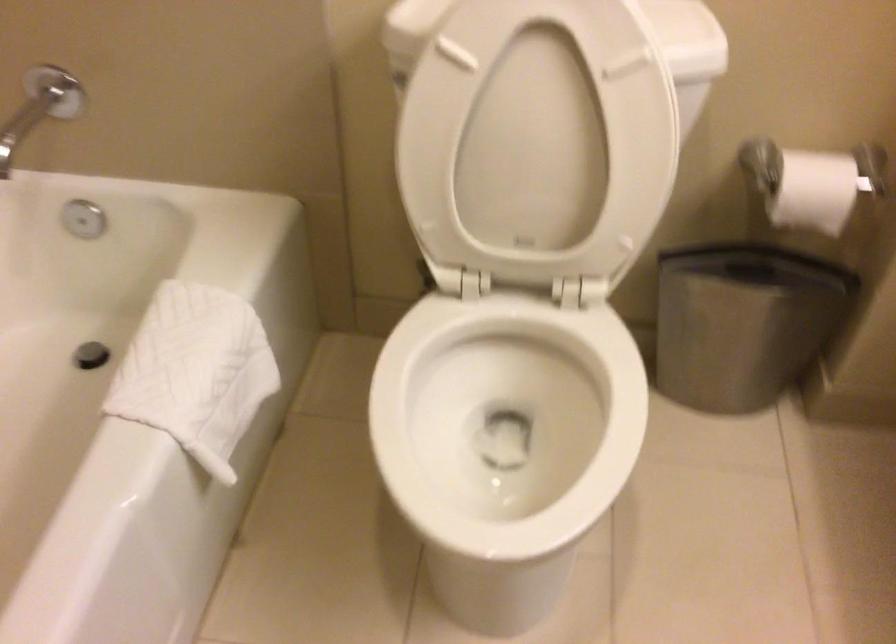
At what (x,y) coordinates should I click in order to perform the action: click on trash can lid. Please return your answer as a coordinate pair (x, y). This screenshot has width=896, height=644. Looking at the image, I should click on (743, 323).